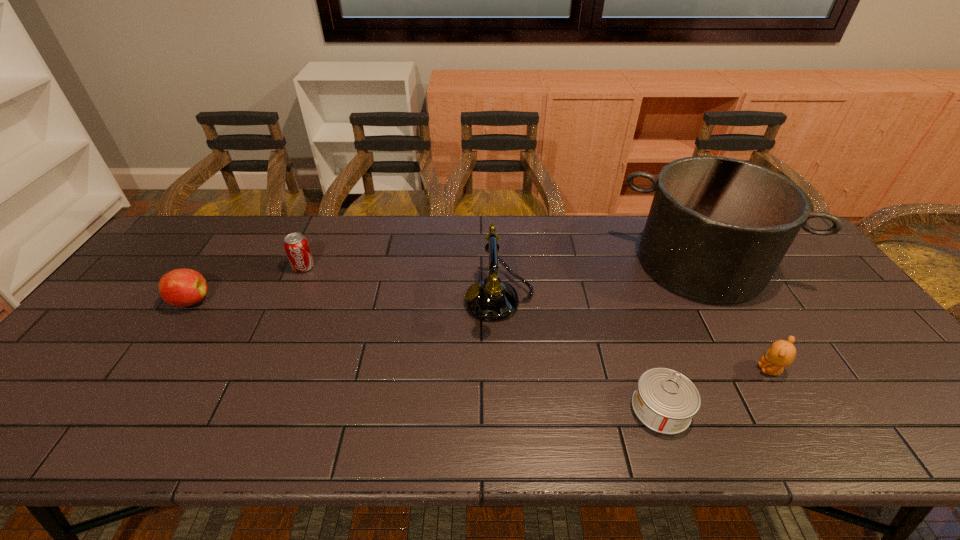
Find the location of a particular element. vacant space located 0.320m on the dial of the telephone is located at coordinates (350, 300).

Find the location of a particular element. This screenshot has width=960, height=540. vacant area situated on the dial of the telephone is located at coordinates (415, 300).

I want to click on free location located 0.080m on the back of the second object from left to right, so click(x=314, y=245).

This screenshot has width=960, height=540. I want to click on free spot located 0.330m on the face of the teddy bear, so click(619, 370).

Where is `free location located on the face of the teddy bear`? This screenshot has height=540, width=960. free location located on the face of the teddy bear is located at coordinates (736, 370).

Where is `free space located 0.220m on the face of the teddy bear`? This screenshot has height=540, width=960. free space located 0.220m on the face of the teddy bear is located at coordinates (665, 370).

Find the location of `free space located 0.050m on the right of the apple`. free space located 0.050m on the right of the apple is located at coordinates (228, 301).

Find the location of a particular element. The width and height of the screenshot is (960, 540). free location located on the left of the nearest object is located at coordinates (451, 408).

Locate an element on the screen. The height and width of the screenshot is (540, 960). object present at the far edge is located at coordinates (718, 228).

Locate an element on the screen. This screenshot has height=540, width=960. object at the near edge is located at coordinates (665, 400).